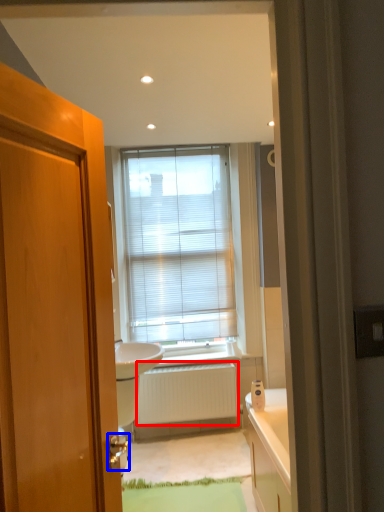
Question: Which point is further to the camera, radiator (highlighted by a red box) or door handle (highlighted by a blue box)?

Choices:
 (A) radiator
 (B) door handle

Answer: (A)